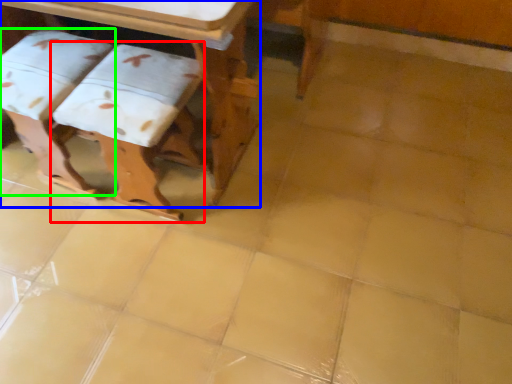
Question: Considering the real-world distances, which object is farthest from step stool (highlighted by a red box)? table (highlighted by a blue box) or step stool (highlighted by a green box)?

Choices:
 (A) table
 (B) step stool

Answer: (A)